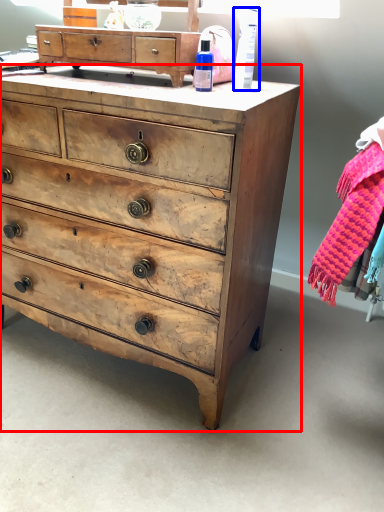
Question: Which point is closer to the camera, chest of drawers (highlighted by a red box) or toiletry (highlighted by a blue box)?

Choices:
 (A) chest of drawers
 (B) toiletry

Answer: (A)